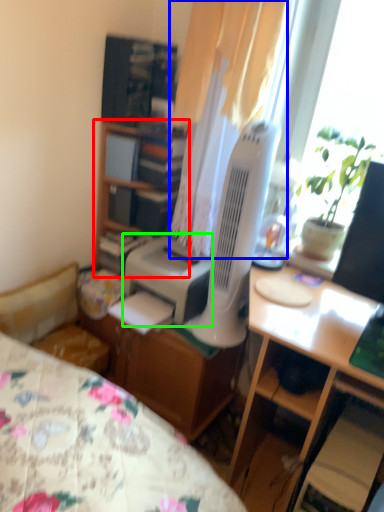
Question: Estimate the real-world distances between objects in this image. Which object is closer to cabinetry (highlighted by a red box), curtain (highlighted by a blue box) or printer (highlighted by a green box)?

Choices:
 (A) curtain
 (B) printer

Answer: (B)